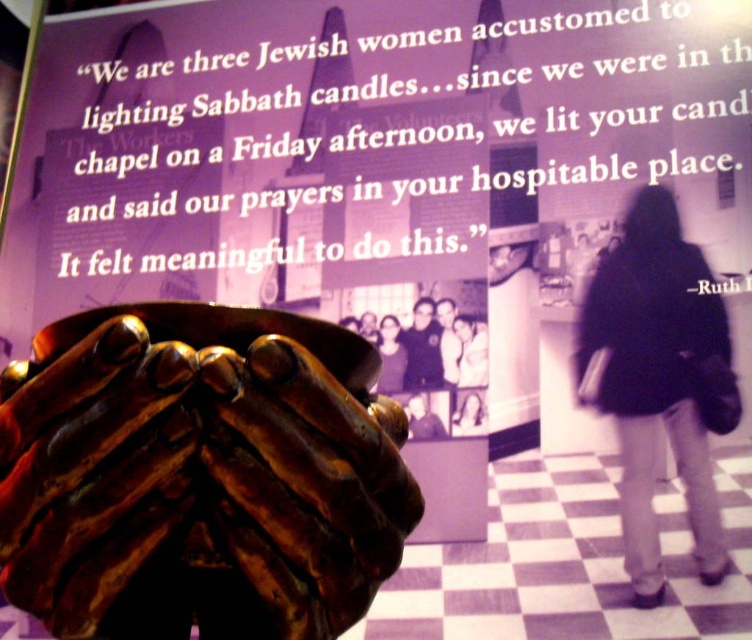
Question: Is shiny bronze hands at center closer to camera compared to dark fabric coat at lower right?

Choices:
 (A) yes
 (B) no

Answer: (A)

Question: Which of the following is the farthest from the observer?

Choices:
 (A) (76, 488)
 (B) (658, 461)

Answer: (B)

Question: Among these objects, which one is nearest to the camera?

Choices:
 (A) dark fabric coat at lower right
 (B) shiny bronze hands at center

Answer: (B)

Question: Which point is farther to the camera?

Choices:
 (A) (693, 328)
 (B) (378, 448)

Answer: (A)

Question: Is shiny bronze hands at center to the left of dark fabric coat at lower right from the viewer's perspective?

Choices:
 (A) no
 (B) yes

Answer: (B)

Question: Can you confirm if shiny bronze hands at center is positioned below dark fabric coat at lower right?

Choices:
 (A) no
 (B) yes

Answer: (B)